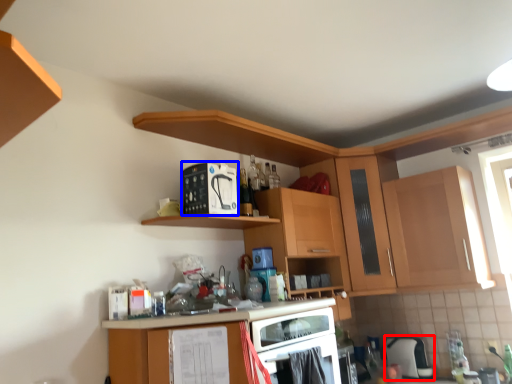
Question: Which of the following is the closest to the observer, appliance (highlighted by a red box) or appliance (highlighted by a blue box)?

Choices:
 (A) appliance
 (B) appliance

Answer: (B)